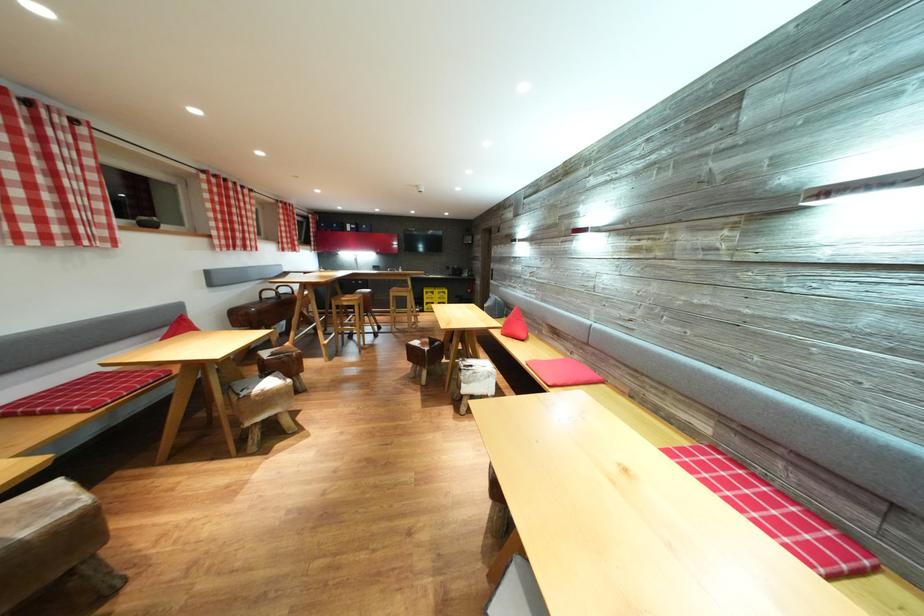
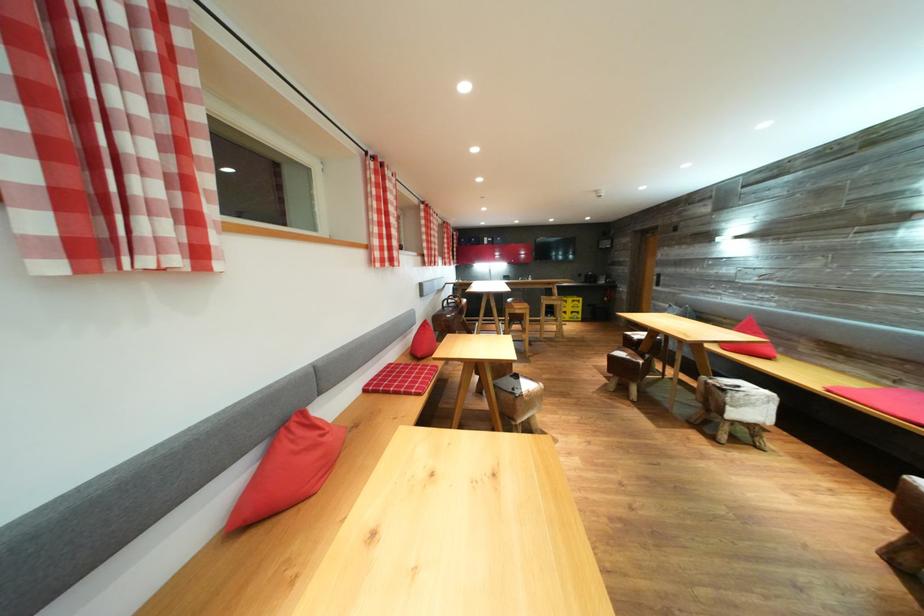
In the second image, find the point that corresponds to (576,360) in the first image.

(895, 389)